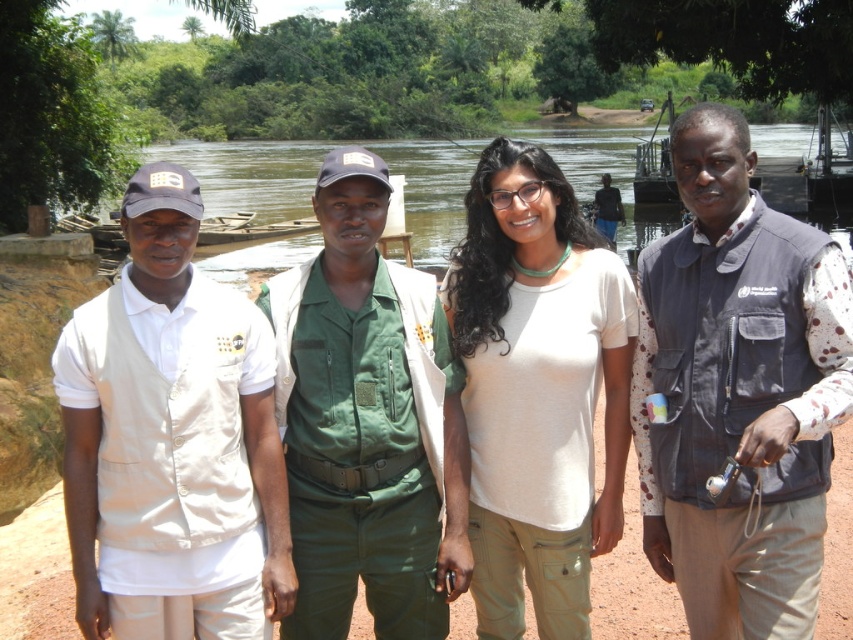
Question: Which is nearer to the beige fabric vest at left?

Choices:
 (A) green uniform at center
 (B) brown wooden river at center
 (C) dark gray vest at right
 (D) white matte shirt at center

Answer: (A)

Question: Can you confirm if green uniform at center is positioned above white matte shirt at center?

Choices:
 (A) no
 (B) yes

Answer: (A)

Question: Which object is farther from the camera taking this photo?

Choices:
 (A) brown wooden river at center
 (B) white matte shirt at center

Answer: (A)

Question: Is green uniform at center to the left of brown wooden river at center from the viewer's perspective?

Choices:
 (A) yes
 (B) no

Answer: (A)

Question: Considering the real-world distances, which object is farthest from the beige fabric vest at left?

Choices:
 (A) green uniform at center
 (B) white matte shirt at center

Answer: (B)

Question: From the image, what is the correct spatial relationship of white matte shirt at center in relation to brown wooden river at center?

Choices:
 (A) left
 (B) right

Answer: (A)